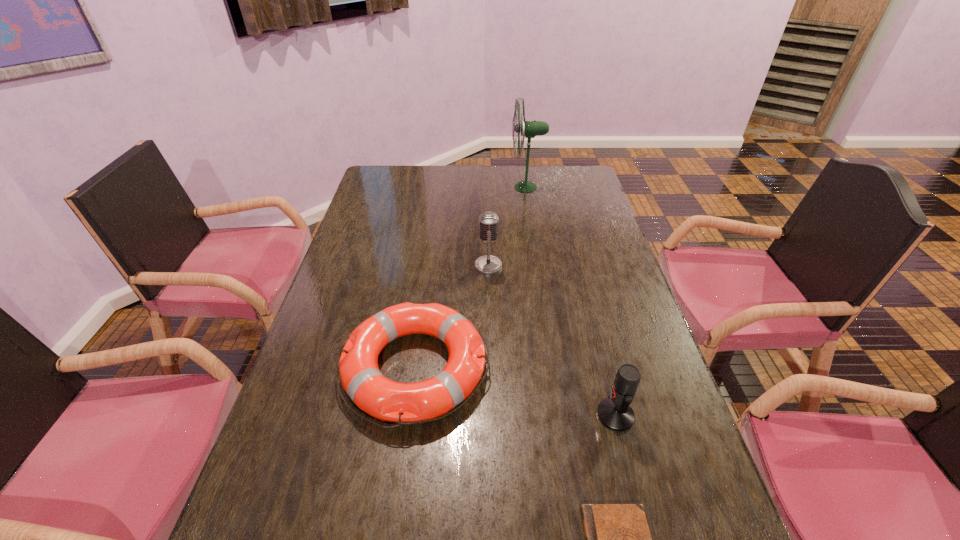
Image resolution: width=960 pixels, height=540 pixels. What are the coordinates of `fan` in the screenshot? It's located at tap(529, 129).

I want to click on the tallest object, so click(529, 129).

You are a GUI agent. You are given a task and a screenshot of the screen. Output one action in this format:
    pyautogui.click(x=<x>, y=<y>)
    Task: Click on the fourth nearest object
    This screenshot has width=960, height=540.
    Given the screenshot: What is the action you would take?
    pyautogui.click(x=488, y=221)

Where is `the farther microphone`? This screenshot has height=540, width=960. the farther microphone is located at coordinates (488, 221).

You are a GUI agent. You are given a task and a screenshot of the screen. Output one action in this format:
    pyautogui.click(x=<x>, y=<y>)
    Task: Click on the shorter microphone
    This screenshot has width=960, height=540.
    Given the screenshot: What is the action you would take?
    pyautogui.click(x=614, y=412)

Find the location of `the right microphone`. the right microphone is located at coordinates (614, 412).

You are a GUI agent. You are given a task and a screenshot of the screen. Output one action in this format:
    pyautogui.click(x=<x>, y=<y>)
    Task: Click on the fourth tallest object
    The image size is (960, 540).
    Given the screenshot: What is the action you would take?
    pyautogui.click(x=405, y=403)

I want to click on vacant space located 0.070m on the front-facing side of the fan, so click(x=492, y=187).

Where is `vacant area situated on the front-facing side of the fan`? vacant area situated on the front-facing side of the fan is located at coordinates (472, 187).

Where is `vacant space situated on the front-facing side of the fan`? The height and width of the screenshot is (540, 960). vacant space situated on the front-facing side of the fan is located at coordinates (430, 187).